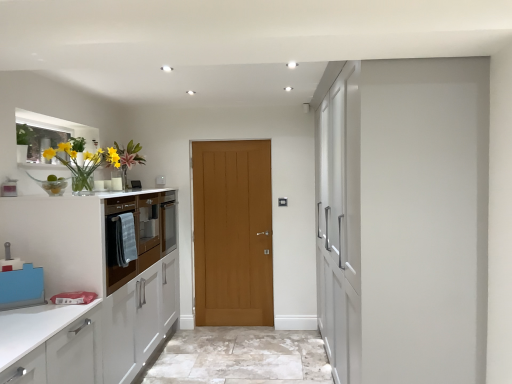
Question: Is white glossy cabinetry at left, acting as the 2th cabinetry starting from the back, in front of or behind matte wood cabinet at left, which is the 1th cabinetry in back-to-front order, in the image?

Choices:
 (A) front
 (B) behind

Answer: (A)

Question: Does point (13, 226) appear closer or farther from the camera than point (114, 198)?

Choices:
 (A) farther
 (B) closer

Answer: (B)

Question: Estimate the real-world distances between objects in this image. Which object is closer to the wooden door at center?

Choices:
 (A) matte wood cabinet at left, which is the 1th cabinetry in back-to-front order
 (B) white glossy cabinetry at left, the 1th cabinetry from the front
 (C) translucent glass vase at left

Answer: (A)

Question: Which object is positioned farthest from the wooden door at center?

Choices:
 (A) matte wood cabinet at left, which is the 1th cabinetry in back-to-front order
 (B) translucent glass vase at left
 (C) white glossy cabinetry at left, acting as the 2th cabinetry starting from the back

Answer: (B)